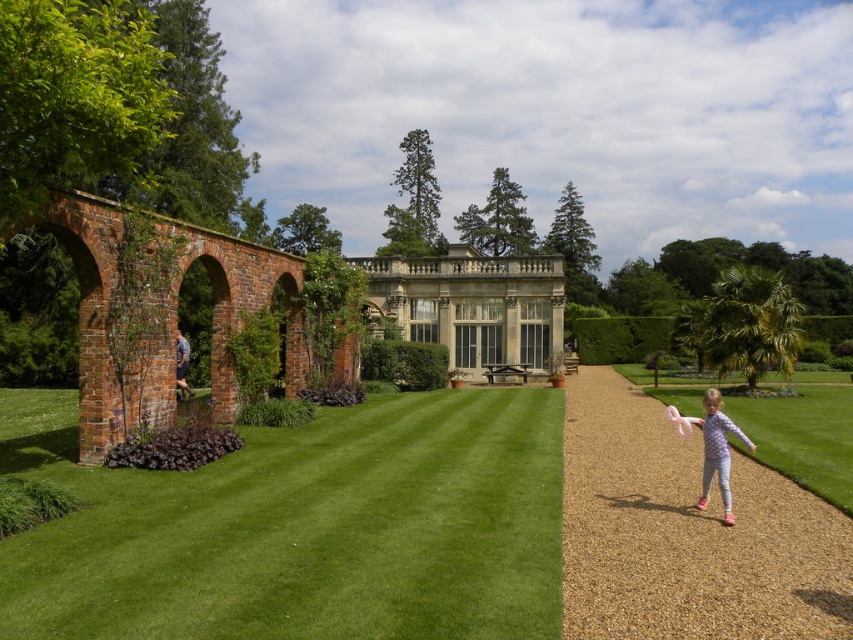
Question: Does green grass at center have a larger size compared to brown gravel path at center?

Choices:
 (A) yes
 (B) no

Answer: (A)

Question: Is light green grass at lower right positioned in front of purple printed pajamas at right?

Choices:
 (A) no
 (B) yes

Answer: (A)

Question: Which object is positioned farthest from the green grass at center?

Choices:
 (A) dark blue jeans at left
 (B) brown gravel path at center
 (C) light green grass at lower right

Answer: (C)

Question: Does green grass at center have a smaller size compared to brown gravel path at center?

Choices:
 (A) yes
 (B) no

Answer: (B)

Question: Among these objects, which one is nearest to the camera?

Choices:
 (A) dark blue jeans at left
 (B) green grass at center
 (C) brown gravel path at center
 (D) purple printed pajamas at right

Answer: (B)

Question: Among these points, which one is farthest from the camera?

Choices:
 (A) (416, 474)
 (B) (811, 621)
 (C) (187, 346)

Answer: (C)